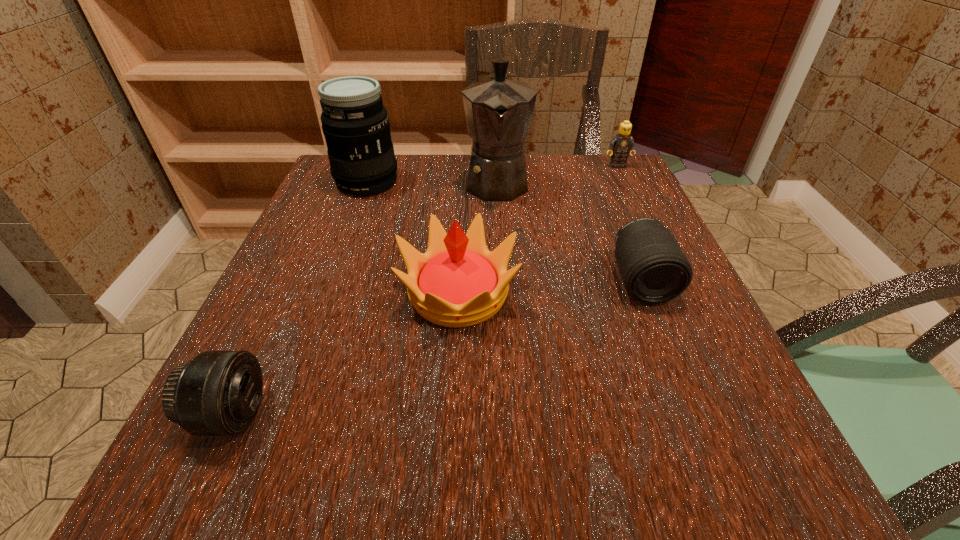
This screenshot has width=960, height=540. Find the location of `free region that satisfies the following two spatial constraints: 1. in front of the Lego; 2. on the front-facing side of the nearest object`. free region that satisfies the following two spatial constraints: 1. in front of the Lego; 2. on the front-facing side of the nearest object is located at coordinates (736, 415).